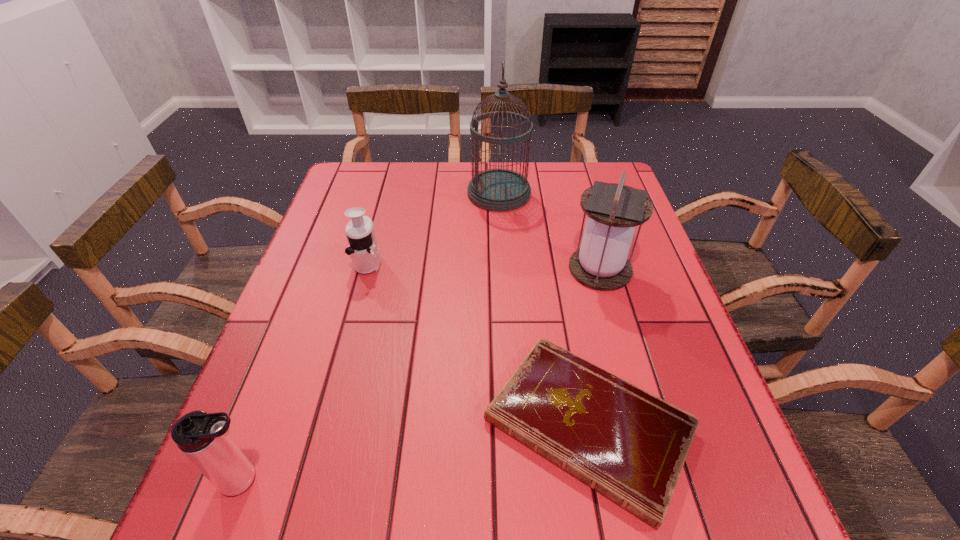
Locate an element on the screen. Image resolution: width=960 pixels, height=540 pixels. the second closest object to the lantern is located at coordinates (499, 190).

Locate an element on the screen. The image size is (960, 540). object that can be found as the second closest to the farthest object is located at coordinates (363, 249).

The image size is (960, 540). Find the location of `vacant space that satisfies the following two spatial constraints: 1. on the front side of the lantern; 2. on the right side of the fourth tallest object`. vacant space that satisfies the following two spatial constraints: 1. on the front side of the lantern; 2. on the right side of the fourth tallest object is located at coordinates (366, 269).

What are the coordinates of `vacant region that satisfies the following two spatial constraints: 1. on the front side of the notebook; 2. on the left side of the juicer` in the screenshot? It's located at (324, 425).

Identify the location of blank area in the image that satisfies the following two spatial constraints: 1. on the front-facing side of the tallest object; 2. on the right side of the fourth shortest object. (503, 269).

The image size is (960, 540). Identify the location of vacant space that satisfies the following two spatial constraints: 1. on the front side of the second tallest object; 2. on the handle side of the leftmost object. (660, 480).